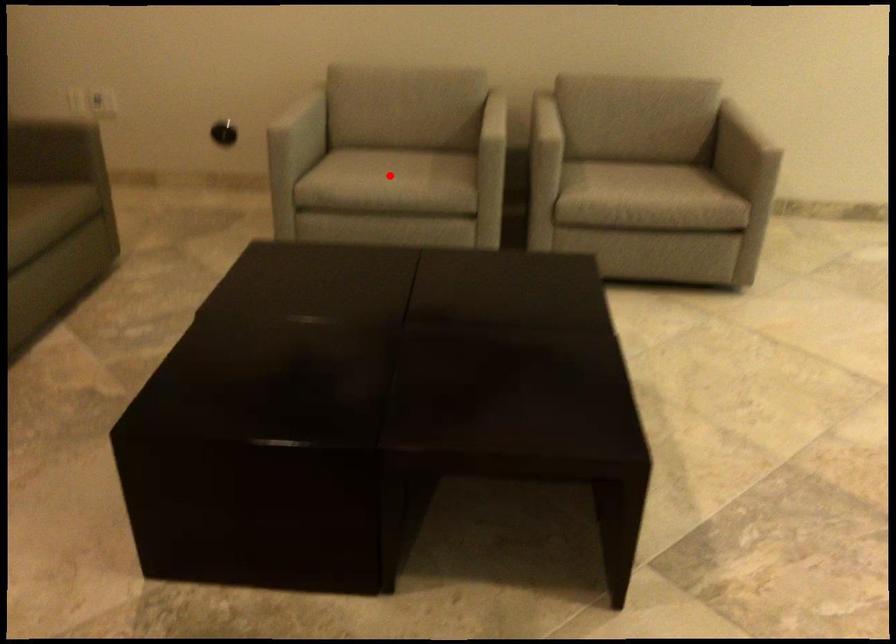
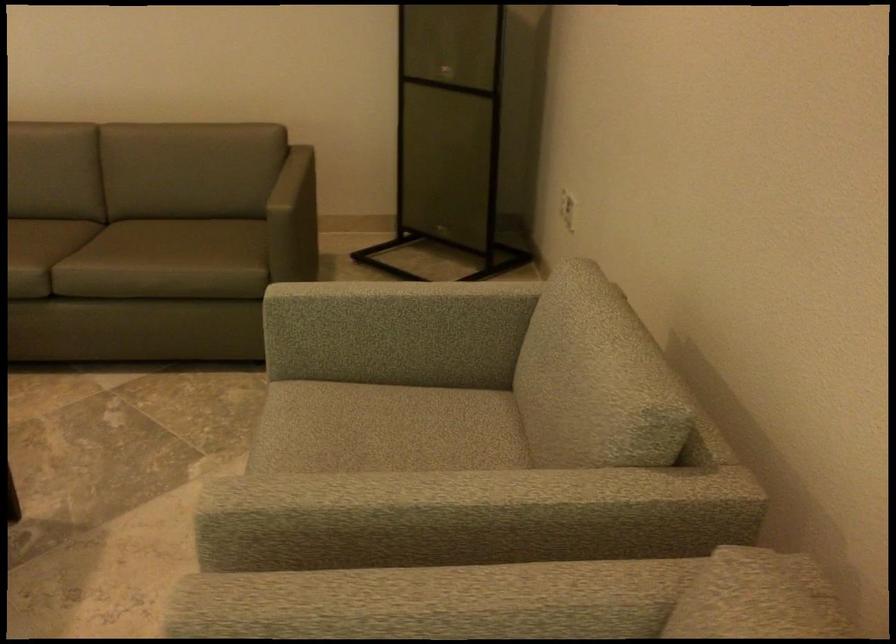
Question: I am providing you with two images of the same scene from different viewpoints. A red point is marked on the first image. Is the red point's position out of view in image 2?

Choices:
 (A) Yes
 (B) No

Answer: (A)